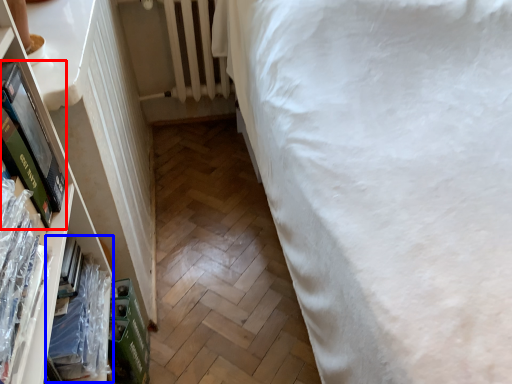
Question: Which of the following is the farthest to the observer, paperback book (highlighted by a red box) or book (highlighted by a blue box)?

Choices:
 (A) paperback book
 (B) book

Answer: (B)